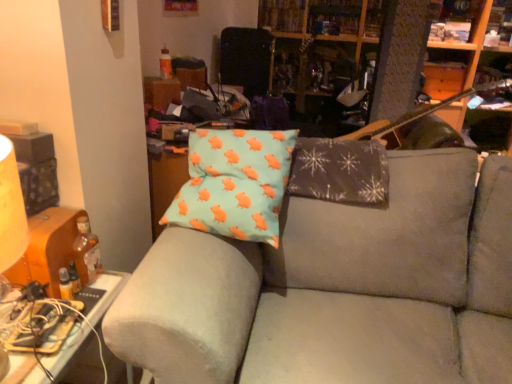
Identify the location of suede couch at center. (338, 288).

The image size is (512, 384). What do you see at coordinates (338, 288) in the screenshot?
I see `suede couch at center` at bounding box center [338, 288].

This screenshot has width=512, height=384. What are the coordinates of `suede couch at center` in the screenshot? It's located at (338, 288).